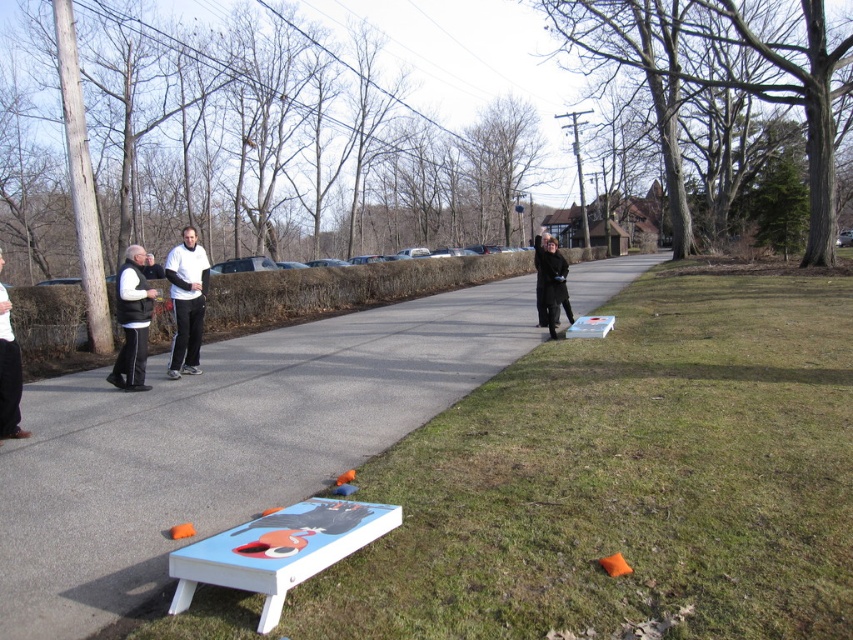
You are standing at the center of the road and want to throw a bean bag to a point closer to the camera. Which point should you aim for, point (x=177, y=269) or point (x=141, y=300)?

Point (x=177, y=269) is further to the camera than point (x=141, y=300), so you should aim for point (x=177, y=269) to hit a point closer to the camera.

You are standing at the edge of the road and want to throw a bean bag to hit the cornhole board closest to the grassy area. Which point, point (x=122, y=289) or point (x=0, y=387), should you aim for?

You should aim for point (x=0, y=387) because it is closer to the grassy area than point (x=122, y=289), which is further away from the grassy area.

From the picture: You are a photographer positioned at the edge of the grassy area. You want to capture a photo that includes both the white matte tracksuit at center and the black vest at left. Which person should you position closer to the camera to ensure both are in focus?

The black vest at left is behind the white matte tracksuit at center, so you should position the white matte tracksuit at center closer to the camera to ensure both are in focus.